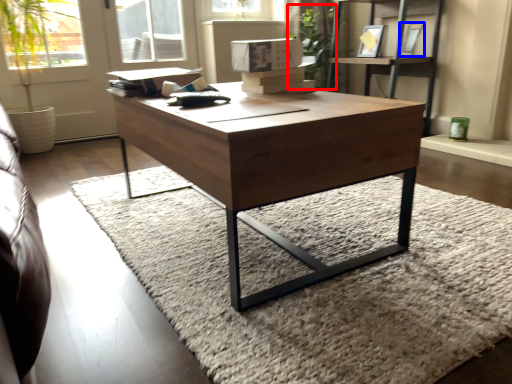
Question: Which object is further to the camera taking this photo, plant (highlighted by a red box) or picture frame (highlighted by a blue box)?

Choices:
 (A) plant
 (B) picture frame

Answer: (A)